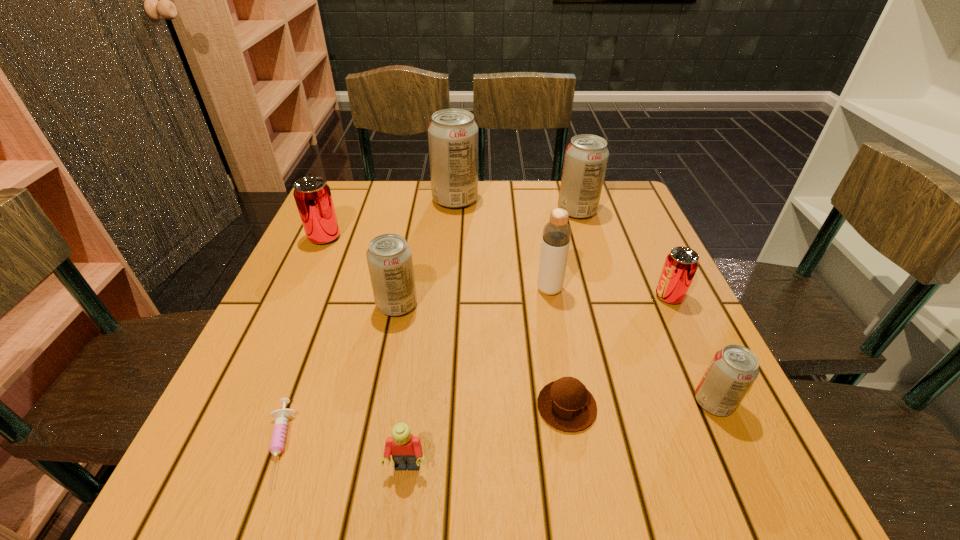
I want to click on object that is the fourth closest one to the eighth tallest object, so click(x=556, y=236).

At what (x,y) coordinates should I click in order to perform the action: click on the sixth closest soda can to the muffin. Please return your answer as a coordinate pair (x, y). Looking at the image, I should click on tap(312, 195).

Locate an element on the screen. The image size is (960, 540). soda can that is the sixth closest one to the shortest object is located at coordinates (586, 157).

Point out which gray soda can is positioned as the second nearest to the third farthest gray soda can. Please provide its 2D coordinates. Your answer should be formatted as a tuple, i.e. [(x, y)], where the tuple contains the x and y coordinates of a point satisfying the conditions above.

[(586, 157)]

Image resolution: width=960 pixels, height=540 pixels. Find the location of `the closest gray soda can to the tallest soda can`. the closest gray soda can to the tallest soda can is located at coordinates (586, 157).

The height and width of the screenshot is (540, 960). Find the location of `vacant position in the image that satisfies the following two spatial constraints: 1. on the back side of the nearer red soda can; 2. on the left side of the second smallest gray soda can`. vacant position in the image that satisfies the following two spatial constraints: 1. on the back side of the nearer red soda can; 2. on the left side of the second smallest gray soda can is located at coordinates (398, 296).

In order to click on vacant region that satisfies the following two spatial constraints: 1. on the front side of the third farthest gray soda can; 2. on the left side of the muffin in this screenshot , I will do `click(376, 407)`.